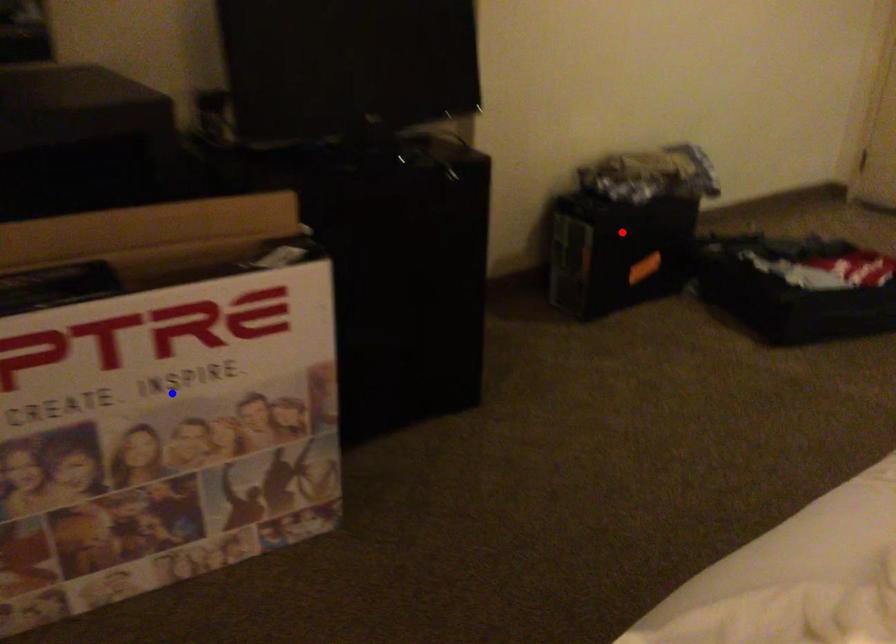
Question: Two points are marked on the image. Which point is closer to the camera?

Choices:
 (A) Blue point is closer.
 (B) Red point is closer.

Answer: (A)